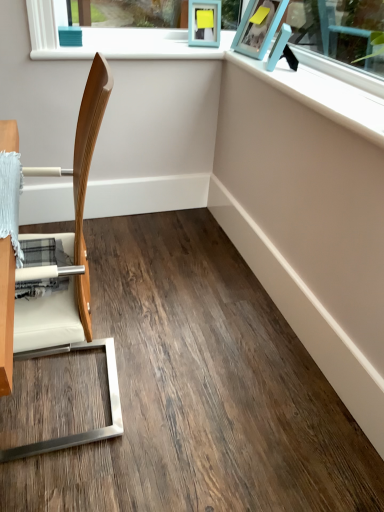
Question: From the image's perspective, is blue plastic picture frame at upper right, the second picture frame in the left-to-right sequence, above or below wooden chair at left?

Choices:
 (A) above
 (B) below

Answer: (A)

Question: Is blue plastic picture frame at upper right, the second picture frame in the left-to-right sequence, inside the boundaries of wooden chair at left, or outside?

Choices:
 (A) outside
 (B) inside

Answer: (A)

Question: Considering the real-world distances, which object is farthest from the blue plastic picture frame at upper right, the second picture frame in the left-to-right sequence?

Choices:
 (A) wooden chair at left
 (B) teal matte picture frame at upper center, which is the 3th picture frame in right-to-left order
 (C) matte blue picture frame at upper right, marked as the third picture frame in a left-to-right arrangement

Answer: (A)

Question: Considering the real-world distances, which object is closest to the wooden chair at left?

Choices:
 (A) teal matte picture frame at upper center, which is the 3th picture frame in right-to-left order
 (B) blue plastic picture frame at upper right, the 2th picture frame positioned from the right
 (C) matte blue picture frame at upper right, marked as the third picture frame in a left-to-right arrangement

Answer: (C)